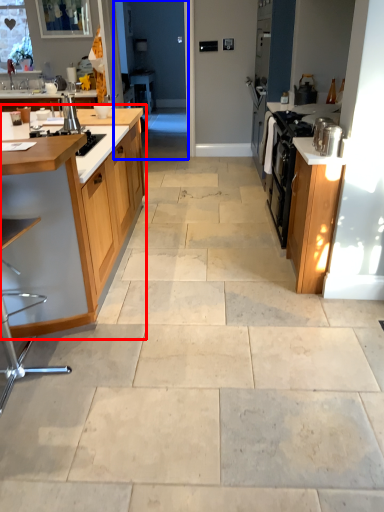
Question: Which object appears farthest to the camera in this image, cabinetry (highlighted by a red box) or screen door (highlighted by a blue box)?

Choices:
 (A) cabinetry
 (B) screen door

Answer: (B)